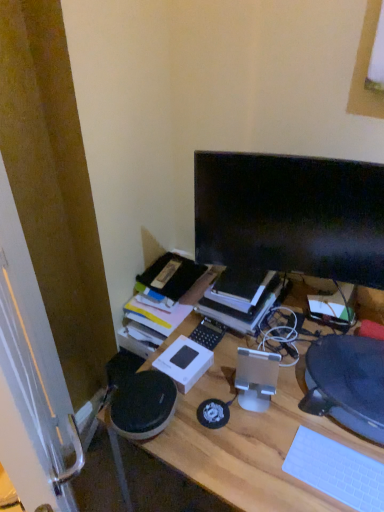
Question: Is wooden desk at center to the right of white matte keyboard at lower right from the viewer's perspective?

Choices:
 (A) yes
 (B) no

Answer: (B)

Question: From a real-world perspective, is wooden desk at center on white matte keyboard at lower right?

Choices:
 (A) no
 (B) yes

Answer: (A)

Question: Is wooden desk at center positioned with its back to white matte keyboard at lower right?

Choices:
 (A) yes
 (B) no

Answer: (B)

Question: Can you confirm if wooden desk at center is shorter than white matte keyboard at lower right?

Choices:
 (A) no
 (B) yes

Answer: (A)

Question: From a real-world perspective, is wooden desk at center positioned under white matte keyboard at lower right based on gravity?

Choices:
 (A) no
 (B) yes

Answer: (B)

Question: Considering the relative sizes of wooden desk at center and white matte keyboard at lower right in the image provided, is wooden desk at center thinner than white matte keyboard at lower right?

Choices:
 (A) no
 (B) yes

Answer: (A)

Question: Does white matte keyboard at lower right lie behind black glossy monitor at upper right?

Choices:
 (A) yes
 (B) no

Answer: (B)

Question: Is white matte keyboard at lower right touching black glossy monitor at upper right?

Choices:
 (A) yes
 (B) no

Answer: (B)

Question: Is white matte keyboard at lower right bigger than black glossy monitor at upper right?

Choices:
 (A) yes
 (B) no

Answer: (B)

Question: Can you confirm if white matte keyboard at lower right is shorter than black glossy monitor at upper right?

Choices:
 (A) no
 (B) yes

Answer: (B)

Question: Can you confirm if white matte keyboard at lower right is positioned to the left of black glossy monitor at upper right?

Choices:
 (A) no
 (B) yes

Answer: (A)

Question: Is white matte keyboard at lower right thinner than black glossy monitor at upper right?

Choices:
 (A) yes
 (B) no

Answer: (B)

Question: Does white matte keyboard at lower right have a smaller size compared to black textured computer chair at right?

Choices:
 (A) no
 (B) yes

Answer: (B)